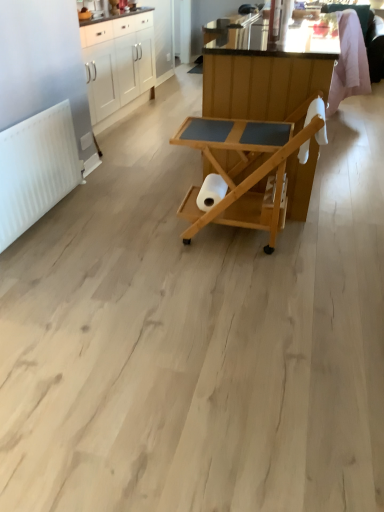
What is the approximate height of white glossy cabinets at upper left?

The height of white glossy cabinets at upper left is 34.99 inches.

Find the location of a particular element. natural wood serving cart at center, the first table viewed from the front is located at coordinates (247, 167).

This screenshot has height=512, width=384. What do you see at coordinates (211, 192) in the screenshot?
I see `white matte toilet paper at center` at bounding box center [211, 192].

This screenshot has height=512, width=384. Identify the location of white matte radiator at left. (36, 169).

This screenshot has height=512, width=384. Find the location of `white glossy cabinets at upper left`. white glossy cabinets at upper left is located at coordinates (118, 61).

Between point (185, 232) and point (103, 90), which one is positioned in front?

The point (185, 232) is closer to the camera.

Is natural wood serving cart at center, the first table viewed from the front, in contact with white glossy cabinets at upper left?

natural wood serving cart at center, the first table viewed from the front, is not next to white glossy cabinets at upper left, and they're not touching.

Is natural wood serving cart at center, the first table viewed from the front, positioned with its back to white glossy cabinets at upper left?

No, natural wood serving cart at center, the first table viewed from the front, is not facing away from white glossy cabinets at upper left.

In terms of width, does natural wood serving cart at center, the first table viewed from the front, look wider or thinner when compared to white glossy cabinets at upper left?

Considering their sizes, natural wood serving cart at center, the first table viewed from the front, looks broader than white glossy cabinets at upper left.

Are white glossy cabinets at upper left and white matte toilet paper at center located far from each other?

That's right, there is a large distance between white glossy cabinets at upper left and white matte toilet paper at center.

Considering the sizes of objects white glossy cabinets at upper left and white matte toilet paper at center in the image provided, who is smaller, white glossy cabinets at upper left or white matte toilet paper at center?

With smaller size is white matte toilet paper at center.

Can you confirm if white glossy cabinets at upper left is positioned to the right of white matte toilet paper at center?

Incorrect, white glossy cabinets at upper left is not on the right side of white matte toilet paper at center.

Is point (220, 124) less distant than point (214, 176)?

That is True.

From the image's perspective, is natural wood serving cart at center, placed as the second table when sorted from back to front, above or below white matte toilet paper at center?

Based on their image positions, natural wood serving cart at center, placed as the second table when sorted from back to front, is located above white matte toilet paper at center.

Can you tell me how much natural wood serving cart at center, placed as the second table when sorted from back to front, and white matte toilet paper at center differ in facing direction?

The angle between the facing direction of natural wood serving cart at center, placed as the second table when sorted from back to front, and the facing direction of white matte toilet paper at center is 91.2 degrees.

Measure the distance from natural wood serving cart at center, the first table viewed from the front, to white matte toilet paper at center.

natural wood serving cart at center, the first table viewed from the front, and white matte toilet paper at center are 9.05 inches apart from each other.

Looking at this image, is white glossy cabinets at upper left shorter than natural wood serving cart at center, placed as the second table when sorted from back to front?

Incorrect, the height of white glossy cabinets at upper left does not fall short of that of natural wood serving cart at center, placed as the second table when sorted from back to front.

From the picture: From a real-world perspective, is white glossy cabinets at upper left physically above natural wood serving cart at center, the first table viewed from the front?

Yes.

Which table is the 2nd one when counting from the front of the white glossy cabinets at upper left? Please provide its 2D coordinates.

[(247, 167)]

Is white glossy cabinets at upper left in front of or behind natural wood serving cart at center, placed as the second table when sorted from back to front, in the image?

Visually, white glossy cabinets at upper left is located behind natural wood serving cart at center, placed as the second table when sorted from back to front.

Measure the distance between white matte radiator at left and natural wood serving cart at center, marked as the first table in a back-to-front arrangement.

white matte radiator at left and natural wood serving cart at center, marked as the first table in a back-to-front arrangement, are 3.56 feet apart from each other.

Is white matte radiator at left facing away from natural wood serving cart at center, marked as the first table in a back-to-front arrangement?

No, white matte radiator at left's orientation is not away from natural wood serving cart at center, marked as the first table in a back-to-front arrangement.

From a real-world perspective, is white matte radiator at left positioned under natural wood serving cart at center, the second table positioned from the front, based on gravity?

Yes.

Does white matte radiator at left have a greater height compared to natural wood serving cart at center, the second table positioned from the front?

No.

Is white matte radiator at left not within white matte toilet paper at center?

Absolutely, white matte radiator at left is external to white matte toilet paper at center.

Between white matte radiator at left and white matte toilet paper at center, which one has larger width?

Wider between the two is white matte toilet paper at center.

From the image's perspective, who appears lower, white matte radiator at left or white matte toilet paper at center?

white matte toilet paper at center appears lower in the image.

Based on the photo, is white matte radiator at left to the left of white matte toilet paper at center from the viewer's perspective?

Indeed, white matte radiator at left is positioned on the left side of white matte toilet paper at center.

Between natural wood serving cart at center, marked as the first table in a back-to-front arrangement, and natural wood serving cart at center, the first table viewed from the front, which one has smaller width?

Thinner between the two is natural wood serving cart at center, the first table viewed from the front.

Is natural wood serving cart at center, marked as the first table in a back-to-front arrangement, turned away from natural wood serving cart at center, placed as the second table when sorted from back to front?

No, natural wood serving cart at center, marked as the first table in a back-to-front arrangement, is not facing away from natural wood serving cart at center, placed as the second table when sorted from back to front.

Visually, is natural wood serving cart at center, marked as the first table in a back-to-front arrangement, positioned to the left or to the right of natural wood serving cart at center, the first table viewed from the front?

natural wood serving cart at center, marked as the first table in a back-to-front arrangement, is to the right of natural wood serving cart at center, the first table viewed from the front.

Which table is the 2nd one when counting from the front of the white glossy cabinets at upper left? Please provide its 2D coordinates.

[(247, 167)]

Where is `cabinetry that appears above the white matte toilet paper at center (from a real-world perspective)`? cabinetry that appears above the white matte toilet paper at center (from a real-world perspective) is located at coordinates (118, 61).

Based on their spatial positions, is natural wood serving cart at center, marked as the first table in a back-to-front arrangement, or white matte radiator at left closer to white glossy cabinets at upper left?

Based on the image, white matte radiator at left appears to be nearer to white glossy cabinets at upper left.

From the image, which object appears to be farther from white glossy cabinets at upper left, white matte radiator at left or white matte toilet paper at center?

The object further to white glossy cabinets at upper left is white matte toilet paper at center.

Looking at the image, which one is located further to white matte toilet paper at center, white matte radiator at left or natural wood serving cart at center, placed as the second table when sorted from back to front?

The object further to white matte toilet paper at center is white matte radiator at left.

Based on their spatial positions, is natural wood serving cart at center, the first table viewed from the front, or white matte radiator at left further from natural wood serving cart at center, marked as the first table in a back-to-front arrangement?

The object further to natural wood serving cart at center, marked as the first table in a back-to-front arrangement, is white matte radiator at left.

Considering their positions, is natural wood serving cart at center, placed as the second table when sorted from back to front, positioned closer to white matte toilet paper at center than white glossy cabinets at upper left?

Based on the image, natural wood serving cart at center, placed as the second table when sorted from back to front, appears to be nearer to white matte toilet paper at center.

Based on their spatial positions, is natural wood serving cart at center, marked as the first table in a back-to-front arrangement, or white matte toilet paper at center further from natural wood serving cart at center, the first table viewed from the front?

white matte toilet paper at center is further to natural wood serving cart at center, the first table viewed from the front.

Considering their positions, is white matte toilet paper at center positioned further to white glossy cabinets at upper left than white matte radiator at left?

white matte toilet paper at center lies further to white glossy cabinets at upper left than the other object.

Estimate the real-world distances between objects in this image. Which object is closer to natural wood serving cart at center, marked as the first table in a back-to-front arrangement, white matte toilet paper at center or white matte radiator at left?

white matte toilet paper at center.

Identify the location of table between natural wood serving cart at center, the first table viewed from the front, and white glossy cabinets at upper left, along the z-axis. (265, 71).

Where is `radiator between white glossy cabinets at upper left and natural wood serving cart at center, the first table viewed from the front, in the up-down direction`? radiator between white glossy cabinets at upper left and natural wood serving cart at center, the first table viewed from the front, in the up-down direction is located at coordinates (36, 169).

Where is `table located between white matte radiator at left and natural wood serving cart at center, the second table positioned from the front, in the left-right direction`? Image resolution: width=384 pixels, height=512 pixels. table located between white matte radiator at left and natural wood serving cart at center, the second table positioned from the front, in the left-right direction is located at coordinates (247, 167).

Identify the location of table that lies between natural wood serving cart at center, marked as the first table in a back-to-front arrangement, and white matte toilet paper at center from top to bottom. (247, 167).